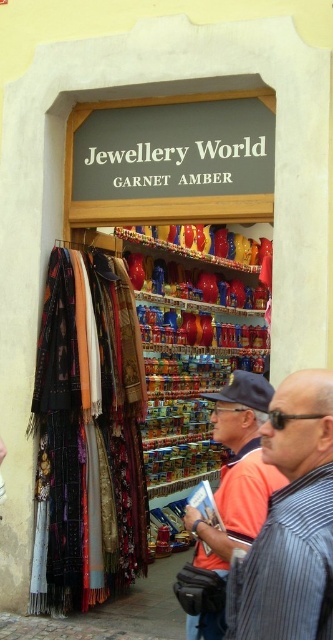
You are a customer in the store and want to know which shirt is shorter between the striped fabric shirt at center and the orange shirt at center. Which one is shorter?

The striped fabric shirt at center is shorter than the orange shirt at center.

You are a customer browsing the shop and want to grab the striped fabric shirt at center. Which direction should you look relative to the orange shirt at center?

The striped fabric shirt at center is above the orange shirt at center, so you should look upwards from the orange shirt at center to find it.